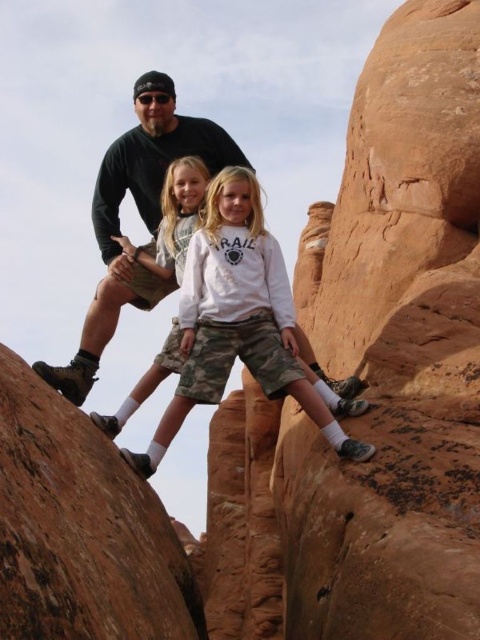
You are a photographer trying to capture the family on the rocks. You need to focus on two specific points in the scene, point [304,273] and point [31,616]. Which point is closer to you, the photographer?

Point [304,273] is closer to you than point [31,616] because it is further to the viewer.

You are a photographer standing at the starting point of the rock formation. You want to take a photo of the white cotton shirt at center and the girl on the left. How far apart are these two subjects in meters?

The white cotton shirt at center and the girl on the left are 52.80 meters apart.